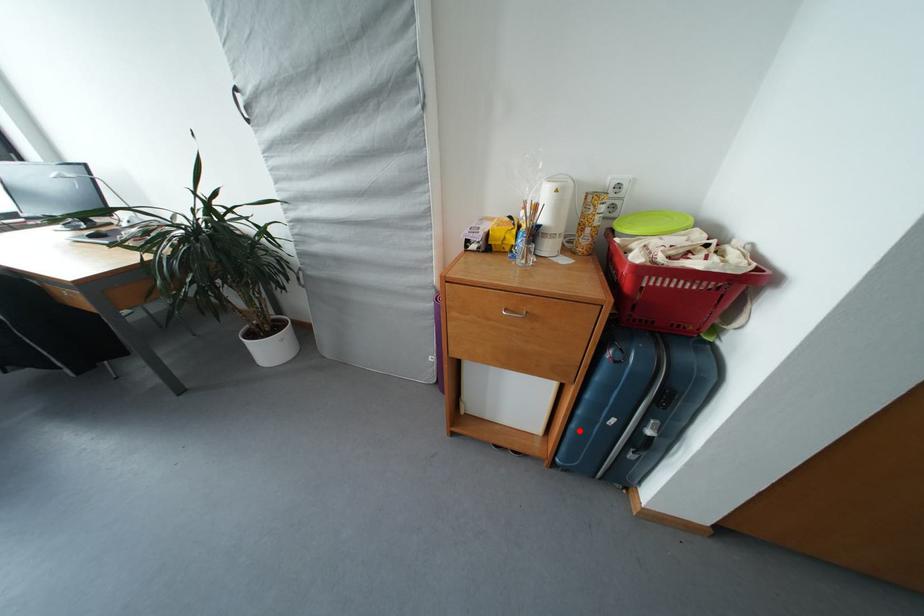
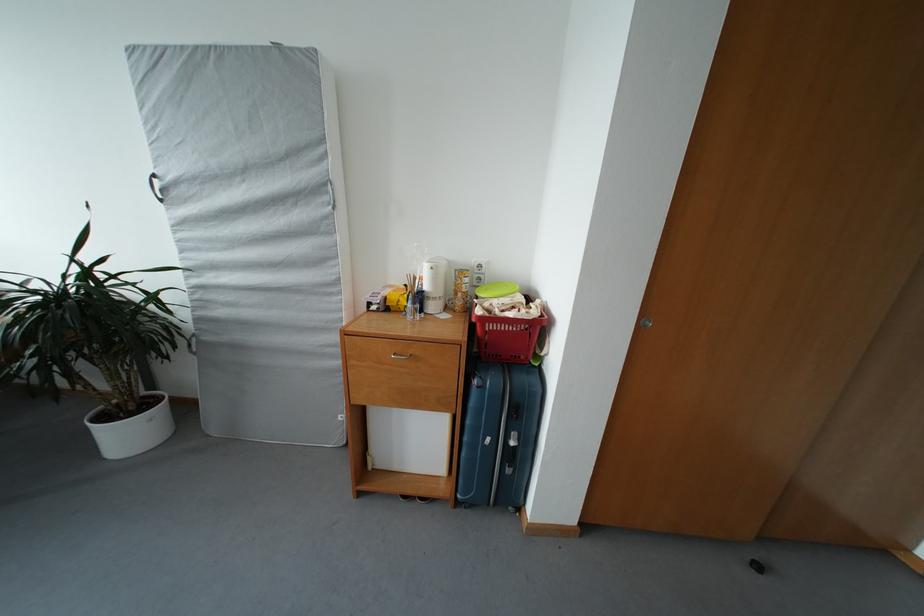
Find the pixel in the second image that matches the highlighted location in the first image.

(469, 459)